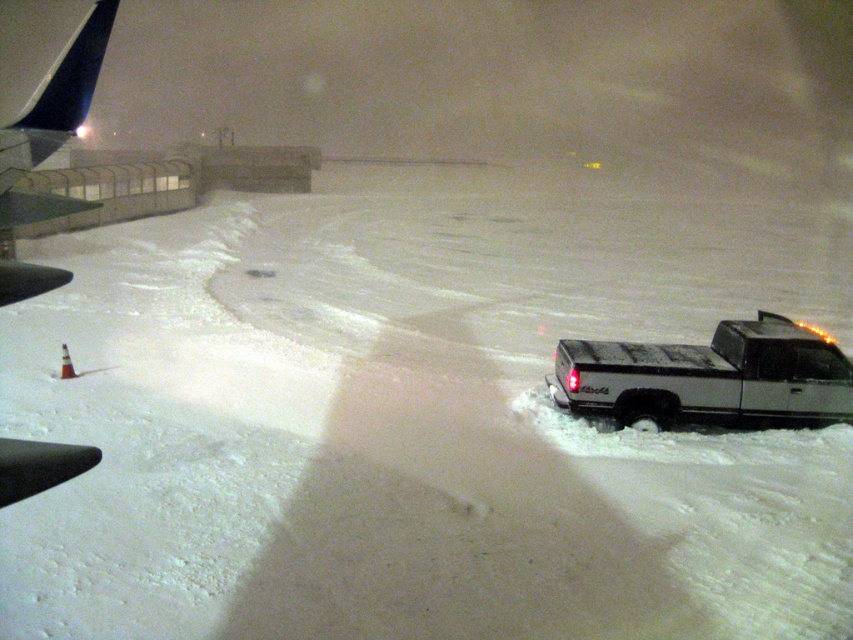
Is dark blue metallic airplane wing at upper left positioned in front of white plastic cone at lower left?

Yes, dark blue metallic airplane wing at upper left is in front of white plastic cone at lower left.

Is dark blue metallic airplane wing at upper left shorter than white plastic cone at lower left?

In fact, dark blue metallic airplane wing at upper left may be taller than white plastic cone at lower left.

This screenshot has height=640, width=853. In order to click on dark blue metallic airplane wing at upper left in this screenshot , I will do `click(44, 104)`.

Is silver metallic truck at right positioned at the back of dark blue metallic airplane wing at upper left?

Yes, it is behind dark blue metallic airplane wing at upper left.

In the scene shown: Does silver metallic truck at right have a greater width compared to dark blue metallic airplane wing at upper left?

No, silver metallic truck at right is not wider than dark blue metallic airplane wing at upper left.

Is point (567, 394) farther from viewer compared to point (45, 148)?

Yes, it is.

You are a GUI agent. You are given a task and a screenshot of the screen. Output one action in this format:
    pyautogui.click(x=<x>, y=<y>)
    Task: Click on the silver metallic truck at right
    
    Given the screenshot: What is the action you would take?
    pyautogui.click(x=709, y=378)

Does silver metallic truck at right have a lesser width compared to white plastic cone at lower left?

Incorrect, silver metallic truck at right's width is not less than white plastic cone at lower left's.

Which is more to the left, silver metallic truck at right or white plastic cone at lower left?

white plastic cone at lower left

You are a GUI agent. You are given a task and a screenshot of the screen. Output one action in this format:
    pyautogui.click(x=<x>, y=<y>)
    Task: Click on the silver metallic truck at right
    This screenshot has width=853, height=640.
    Given the screenshot: What is the action you would take?
    pyautogui.click(x=709, y=378)